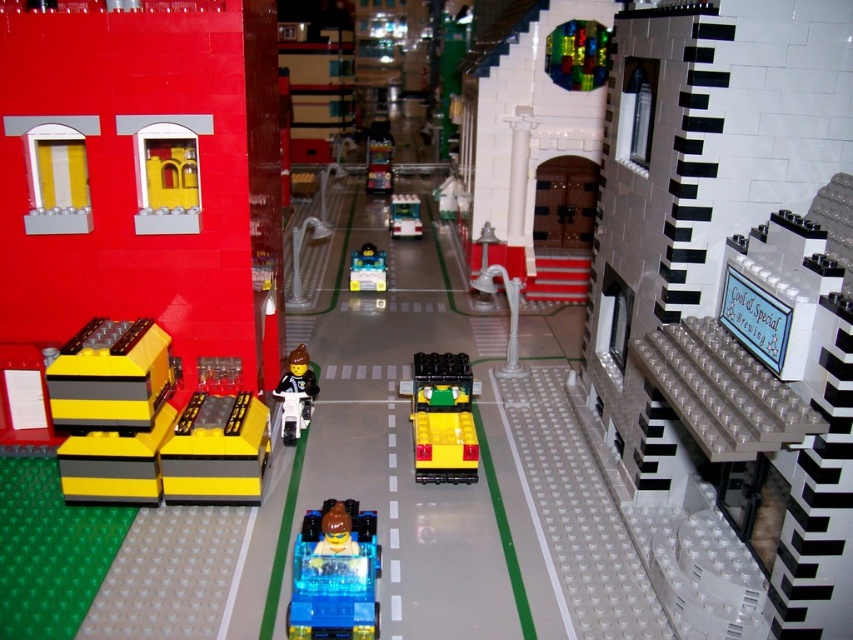
Can you confirm if translucent blue plastic vending machine at center is positioned to the left of translucent green plastic bus at center?

Indeed, translucent blue plastic vending machine at center is positioned on the left side of translucent green plastic bus at center.

Is point (378, 140) more distant than point (393, 195)?

Yes.

Where is `translucent blue plastic vending machine at center`? The width and height of the screenshot is (853, 640). translucent blue plastic vending machine at center is located at coordinates (379, 164).

Who is taller, translucent yellow plastic car at center or translucent blue plastic vending machine at center?

With more height is translucent blue plastic vending machine at center.

Can you confirm if translucent yellow plastic car at center is smaller than translucent blue plastic vending machine at center?

Yes, translucent yellow plastic car at center is smaller than translucent blue plastic vending machine at center.

Where is `translucent yellow plastic car at center`? The width and height of the screenshot is (853, 640). translucent yellow plastic car at center is located at coordinates (367, 269).

How far apart are transparent blue car at center and smooth black motorcycle at center?

20.34 inches

From the picture: Does transparent blue car at center have a greater height compared to smooth black motorcycle at center?

In fact, transparent blue car at center may be shorter than smooth black motorcycle at center.

Which is behind, point (314, 604) or point (294, 404)?

The point (294, 404) is more distant.

The height and width of the screenshot is (640, 853). In order to click on transparent blue car at center in this screenshot , I will do `click(335, 573)`.